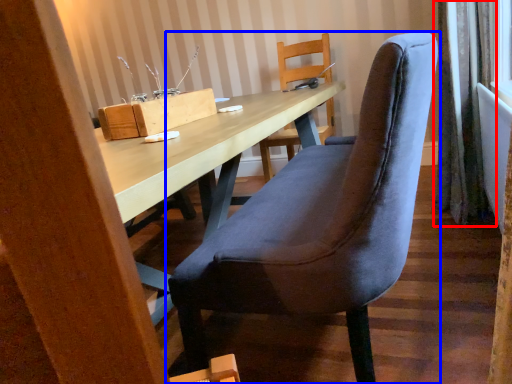
Question: Which object appears closest to the camera in this image, curtain (highlighted by a red box) or chair (highlighted by a blue box)?

Choices:
 (A) curtain
 (B) chair

Answer: (B)